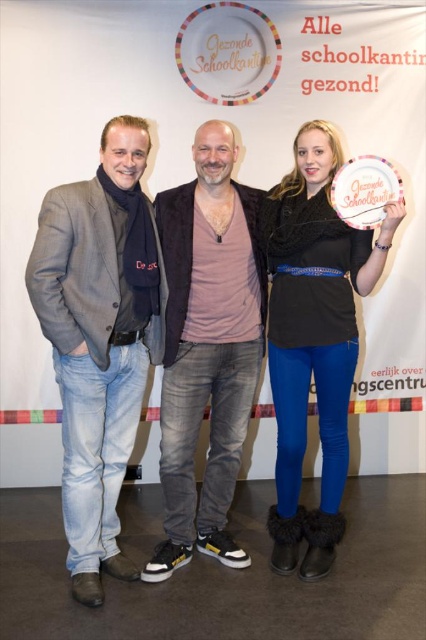
How far apart are matte pink shirt at center and matte black sweater at center?

They are 11.65 inches apart.

This screenshot has height=640, width=426. What do you see at coordinates (207, 348) in the screenshot? I see `matte pink shirt at center` at bounding box center [207, 348].

This screenshot has width=426, height=640. I want to click on matte pink shirt at center, so click(x=207, y=348).

Where is `matte pink shirt at center`? matte pink shirt at center is located at coordinates (207, 348).

Is light blue denim jeans at left bigger than matte pink shirt at center?

No, light blue denim jeans at left is not bigger than matte pink shirt at center.

Is the position of light blue denim jeans at left less distant than that of matte pink shirt at center?

Yes, it is in front of matte pink shirt at center.

Who is more distant from viewer, (121, 577) or (222, 205)?

The point (222, 205) is more distant.

Locate an element on the screen. light blue denim jeans at left is located at coordinates (100, 337).

Can you confirm if light blue denim jeans at left is smaller than matte black sweater at center?

Correct, light blue denim jeans at left occupies less space than matte black sweater at center.

Is point (100, 400) positioned in front of point (281, 556)?

Yes, it is in front of point (281, 556).

Between point (129, 120) and point (311, 372), which one is positioned behind?

Positioned behind is point (311, 372).

This screenshot has height=640, width=426. Identify the location of light blue denim jeans at left. (100, 337).